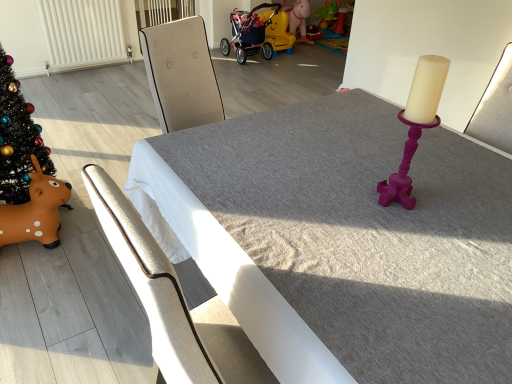
Question: Would you say pink fabric baby carriage at upper center is inside or outside smooth gray table at center?

Choices:
 (A) outside
 (B) inside

Answer: (A)

Question: Would you say pink fabric baby carriage at upper center is to the left or to the right of smooth gray table at center in the picture?

Choices:
 (A) right
 (B) left

Answer: (B)

Question: Considering the real-world distances, which object is farthest from the metallic silver chair at center?

Choices:
 (A) rubber yellow horse at center, which is the second toy from left to right
 (B) white textured radiator at upper left
 (C) smooth gray table at center
 (D) shiny black christmas tree at left
 (E) orange rubber reindeer at lower left, the first toy from the bottom

Answer: (A)

Question: Which of these objects is positioned closest to the pink fabric baby carriage at upper center?

Choices:
 (A) rubber yellow horse at center, the first toy viewed from the back
 (B) orange rubber reindeer at lower left, the 2th toy from the back
 (C) smooth gray table at center
 (D) metallic silver chair at center
 (E) white textured radiator at upper left

Answer: (A)